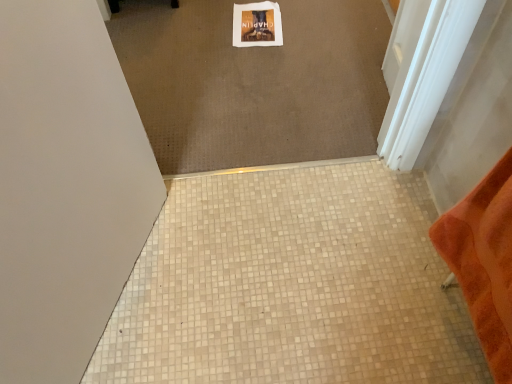
Question: Is white glossy screen door at upper right bigger than white mosaic tile at center?

Choices:
 (A) yes
 (B) no

Answer: (B)

Question: From the image's perspective, is white glossy screen door at upper right beneath white mosaic tile at center?

Choices:
 (A) yes
 (B) no

Answer: (B)

Question: Does white glossy screen door at upper right have a greater width compared to white mosaic tile at center?

Choices:
 (A) no
 (B) yes

Answer: (A)

Question: Is white glossy screen door at upper right to the left of white mosaic tile at center from the viewer's perspective?

Choices:
 (A) yes
 (B) no

Answer: (B)

Question: Is white glossy screen door at upper right facing towards white mosaic tile at center?

Choices:
 (A) yes
 (B) no

Answer: (A)

Question: From the image's perspective, is white glossy screen door at upper right located above white mosaic tile at center?

Choices:
 (A) no
 (B) yes

Answer: (B)

Question: Is white mosaic tile at center oriented towards white glossy screen door at upper right?

Choices:
 (A) yes
 (B) no

Answer: (B)

Question: Can you confirm if white mosaic tile at center is thinner than white glossy screen door at upper right?

Choices:
 (A) yes
 (B) no

Answer: (B)

Question: Is white mosaic tile at center wider than white glossy screen door at upper right?

Choices:
 (A) no
 (B) yes

Answer: (B)

Question: Can you confirm if white mosaic tile at center is taller than white glossy screen door at upper right?

Choices:
 (A) yes
 (B) no

Answer: (B)

Question: Is white mosaic tile at center to the right of white glossy screen door at upper right from the viewer's perspective?

Choices:
 (A) yes
 (B) no

Answer: (B)

Question: From the image's perspective, would you say white mosaic tile at center is shown under white glossy screen door at upper right?

Choices:
 (A) yes
 (B) no

Answer: (A)

Question: In terms of size, does white mosaic tile at center appear bigger or smaller than white glossy screen door at upper right?

Choices:
 (A) small
 (B) big

Answer: (B)